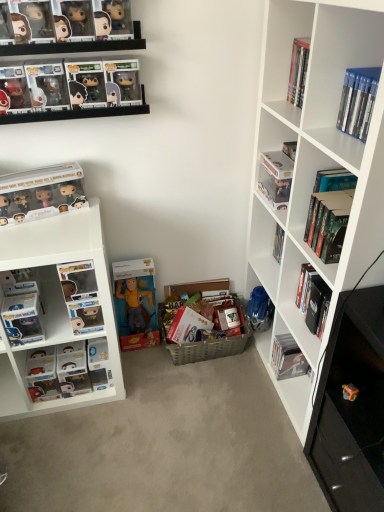
Locate an element on the screen. The image size is (384, 512). vacant area in front of white plastic shelves at left is located at coordinates (69, 451).